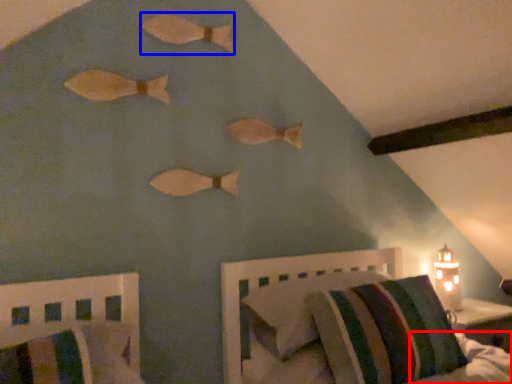
Question: Which point is further to the camera, mattress (highlighted by a red box) or animal (highlighted by a blue box)?

Choices:
 (A) mattress
 (B) animal

Answer: (A)